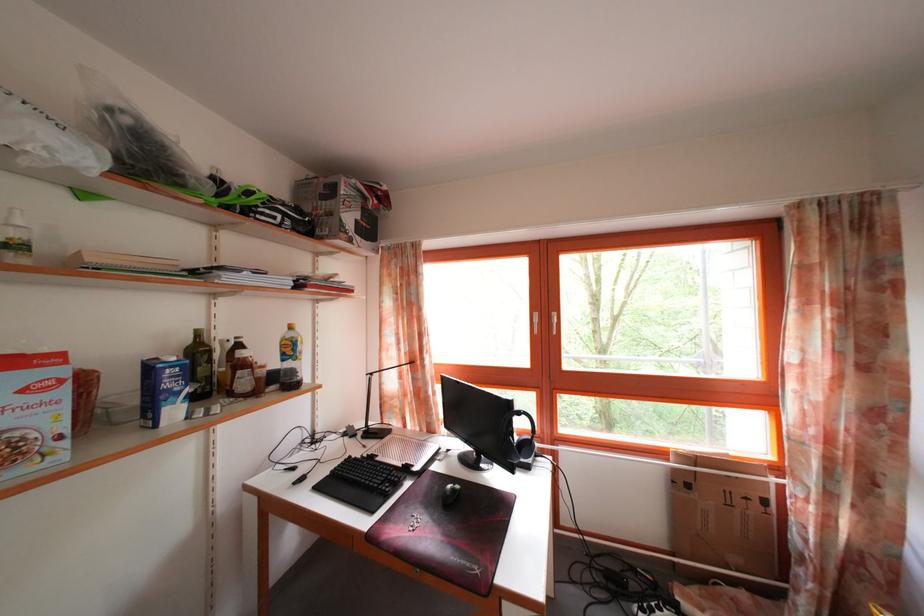
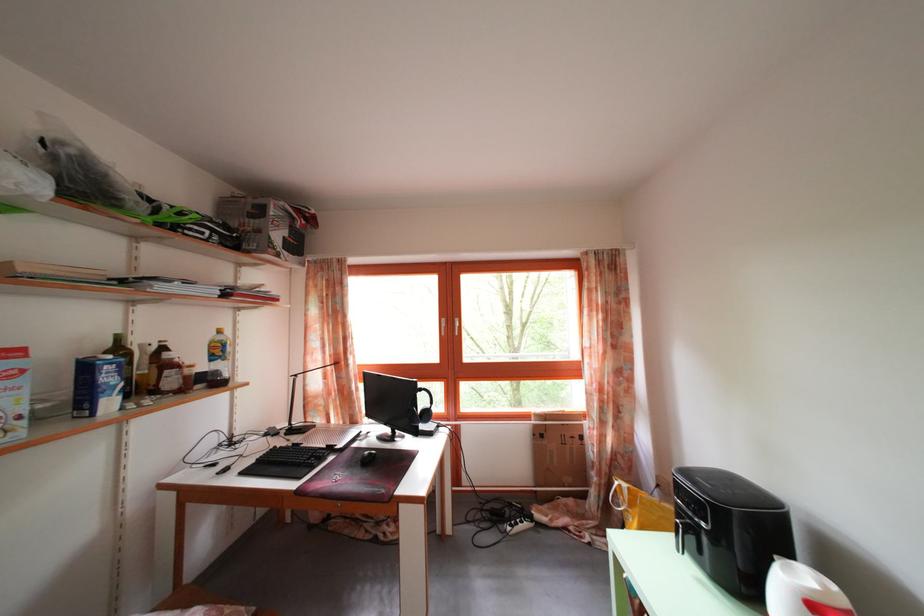
Find the pixel in the second image that matches point 526,419 in the first image.

(428, 397)